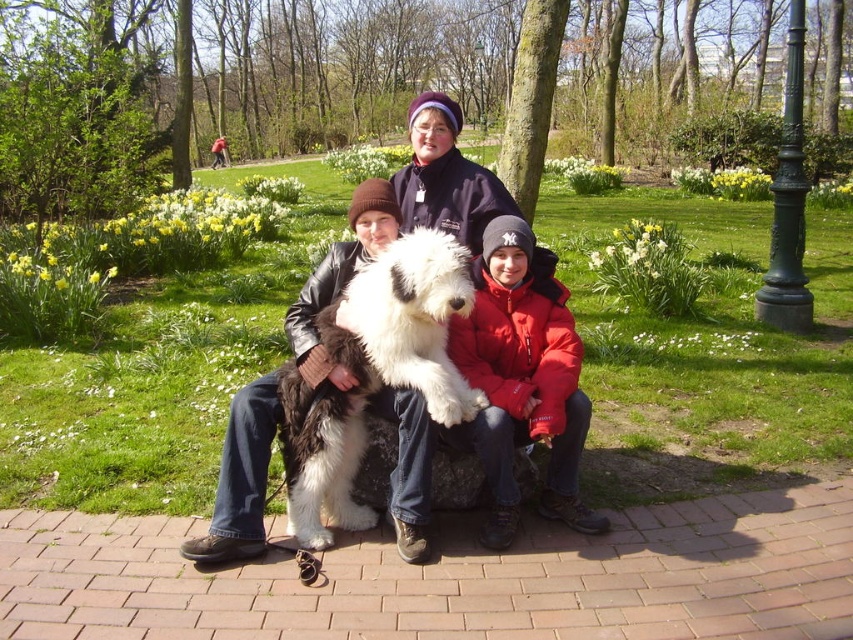
Between point (489, 536) and point (299, 372), which one is positioned behind?

Point (299, 372)

Which is above, fluffy wool dog at center or white fluffy dog at center?

Positioned higher is fluffy wool dog at center.

The image size is (853, 640). Identify the location of fluffy wool dog at center. (401, 220).

Can you confirm if white fluffy dog at center is bigger than red puffy jacket at center?

Yes, white fluffy dog at center is bigger than red puffy jacket at center.

Is point (416, 333) positioned in front of point (485, 323)?

Yes, point (416, 333) is closer to viewer.

Where is `white fluffy dog at center`? white fluffy dog at center is located at coordinates (373, 376).

I want to click on white fluffy dog at center, so click(373, 376).

Who is positioned more to the right, fluffy wool dog at center or red puffy jacket at center?

red puffy jacket at center is more to the right.

Can you confirm if fluffy wool dog at center is wider than red puffy jacket at center?

In fact, fluffy wool dog at center might be narrower than red puffy jacket at center.

Is point (346, 243) behind point (498, 323)?

Yes, it is.

Where is `fluffy wool dog at center`? fluffy wool dog at center is located at coordinates (401, 220).